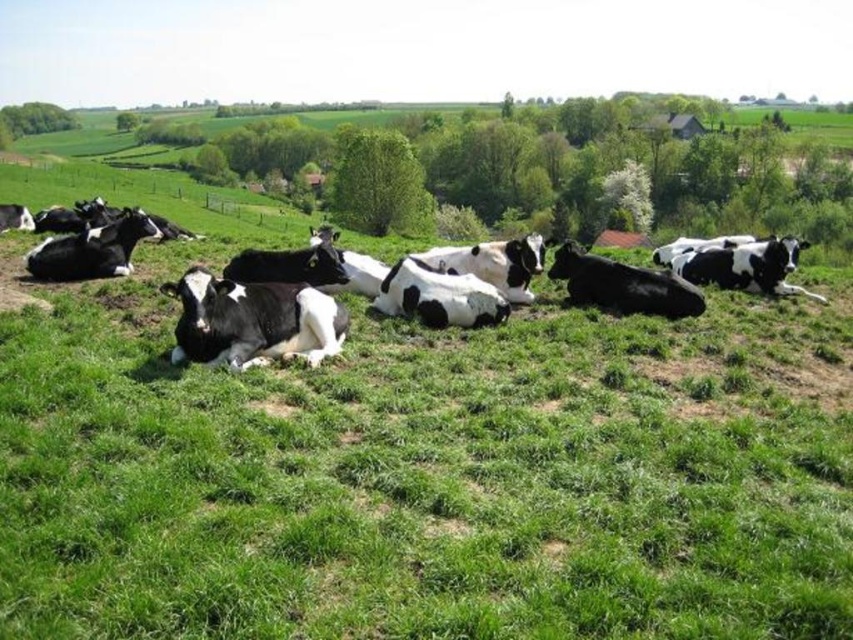
You are a farmer checking the health of your cows. You notice two black and white patterns in the center of the image. Which one is more likely to be the fur of a healthy cow, the black and white fur at center or the black and white cow at center?

The black and white cow at center is more likely to be the fur of a healthy cow because its fur is thicker than the black and white fur at center.

You are a farmer checking the herd. You notice two cows at the center of the field. Which cow is closer to you, the black and white cow at center or the black smooth cow at center?

The black and white cow at center is closer to you because it is in front of the black smooth cow at center.